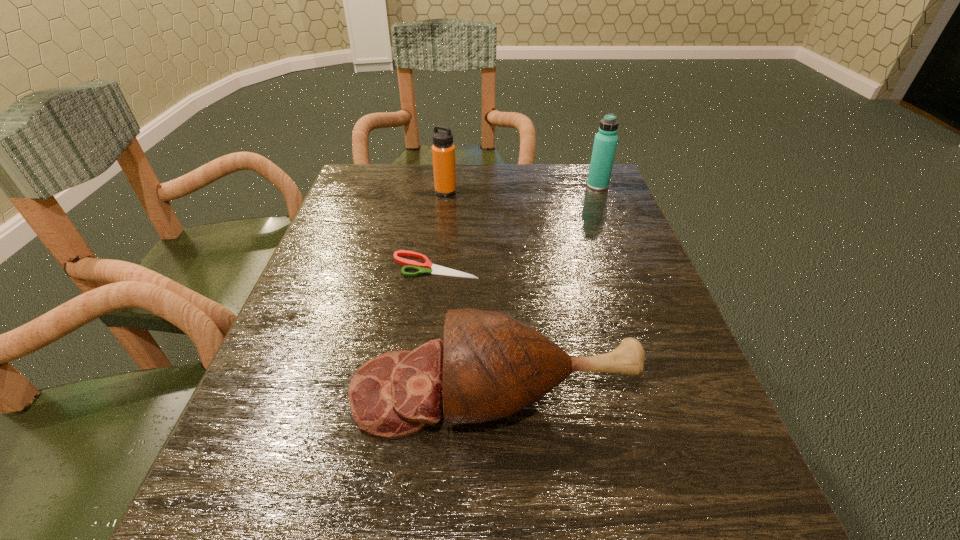
Where is `vacant space located on the front of the scissors`? This screenshot has width=960, height=540. vacant space located on the front of the scissors is located at coordinates (431, 303).

Locate an element on the screen. This screenshot has height=540, width=960. object that is at the left edge is located at coordinates (490, 366).

Where is `thermos bottle at the right edge`? Image resolution: width=960 pixels, height=540 pixels. thermos bottle at the right edge is located at coordinates (605, 142).

What are the coordinates of `ham present at the right edge` in the screenshot? It's located at (490, 366).

Find the location of a particular element. object situated at the far right corner is located at coordinates (605, 142).

This screenshot has height=540, width=960. In the image, there is a desktop. In order to click on vacant space at the far edge in this screenshot , I will do `click(508, 209)`.

This screenshot has height=540, width=960. What are the coordinates of `vacant region at the left edge of the desktop` in the screenshot? It's located at (352, 230).

You are a GUI agent. You are given a task and a screenshot of the screen. Output one action in this format:
    pyautogui.click(x=<x>, y=<y>)
    Task: Click on the vacant area at the right edge of the desktop
    The width and height of the screenshot is (960, 540).
    Given the screenshot: What is the action you would take?
    pyautogui.click(x=627, y=303)

Locate an element on the screen. The width and height of the screenshot is (960, 540). vacant space at the far left corner of the desktop is located at coordinates (413, 167).

Locate an element on the screen. This screenshot has width=960, height=540. free spot between the right thermos bottle and the scissors is located at coordinates (516, 226).